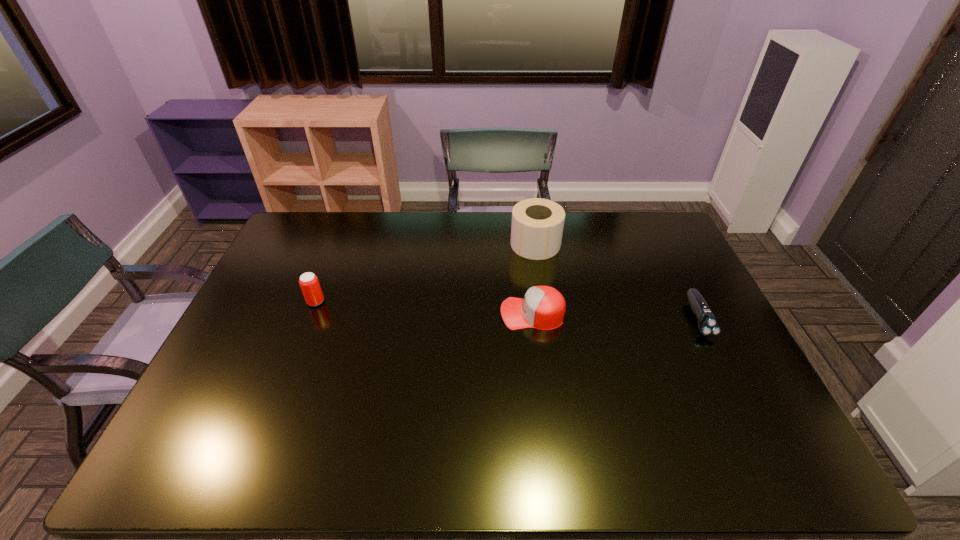
Where is `free space located on the front-facing side of the baseball cap`? Image resolution: width=960 pixels, height=540 pixels. free space located on the front-facing side of the baseball cap is located at coordinates (461, 314).

Where is `vacant space situated on the front-facing side of the baseball cap`? vacant space situated on the front-facing side of the baseball cap is located at coordinates (371, 314).

Find the location of a particular element. Image resolution: width=960 pixels, height=540 pixels. blank area located on the head of the shortest object is located at coordinates (756, 436).

Image resolution: width=960 pixels, height=540 pixels. Identify the location of object that is at the far edge. (537, 225).

Locate an element on the screen. The height and width of the screenshot is (540, 960). object that is at the right edge is located at coordinates (708, 326).

Where is `vacant area at the far edge`? The width and height of the screenshot is (960, 540). vacant area at the far edge is located at coordinates (509, 221).

In order to click on vacant space at the near edge of the desktop in this screenshot , I will do (471, 452).

Where is `free space at the left edge of the desktop`? free space at the left edge of the desktop is located at coordinates (192, 407).

Find the location of a particular element. This screenshot has height=540, width=960. vacant space at the right edge is located at coordinates (661, 262).

Image resolution: width=960 pixels, height=540 pixels. In the image, there is a desktop. Identify the location of blank space at the far left corner. (300, 213).